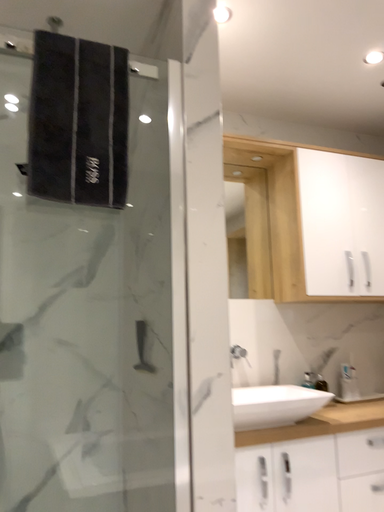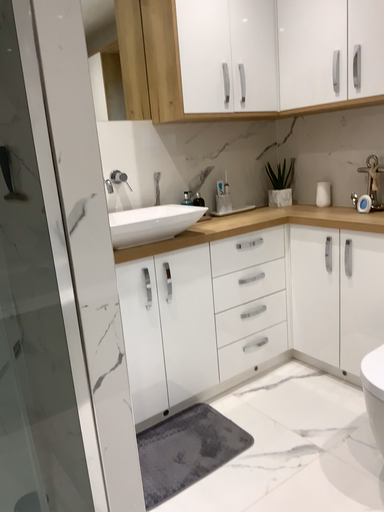
Question: Which way did the camera rotate in the video?

Choices:
 (A) rotated right
 (B) rotated left

Answer: (A)